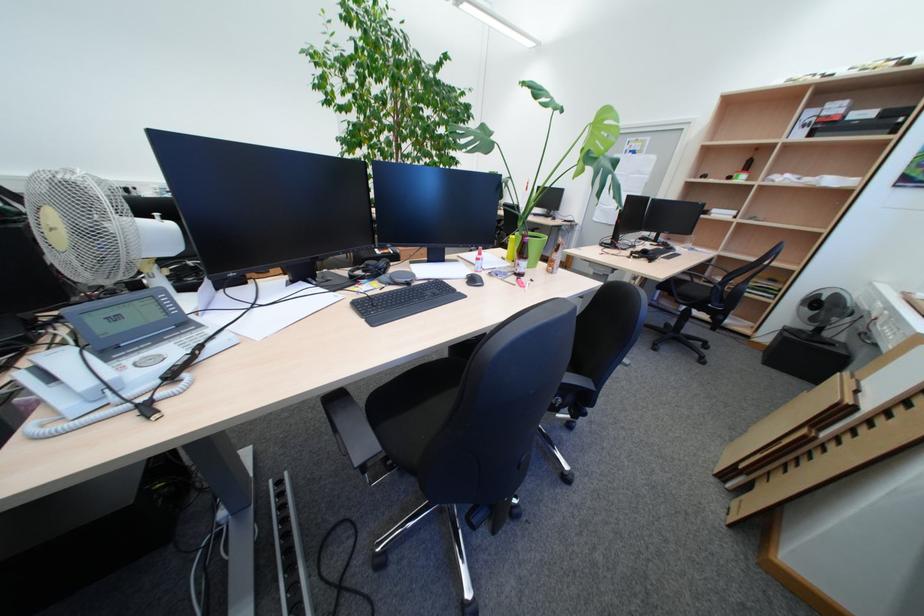
The image size is (924, 616). In order to click on pink marker in this screenshot , I will do `click(520, 281)`.